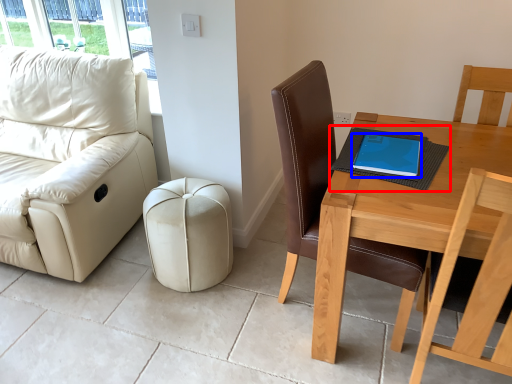
Question: Which object is closer to the camera taking this photo, notebook (highlighted by a red box) or tablet computer (highlighted by a blue box)?

Choices:
 (A) notebook
 (B) tablet computer

Answer: (A)